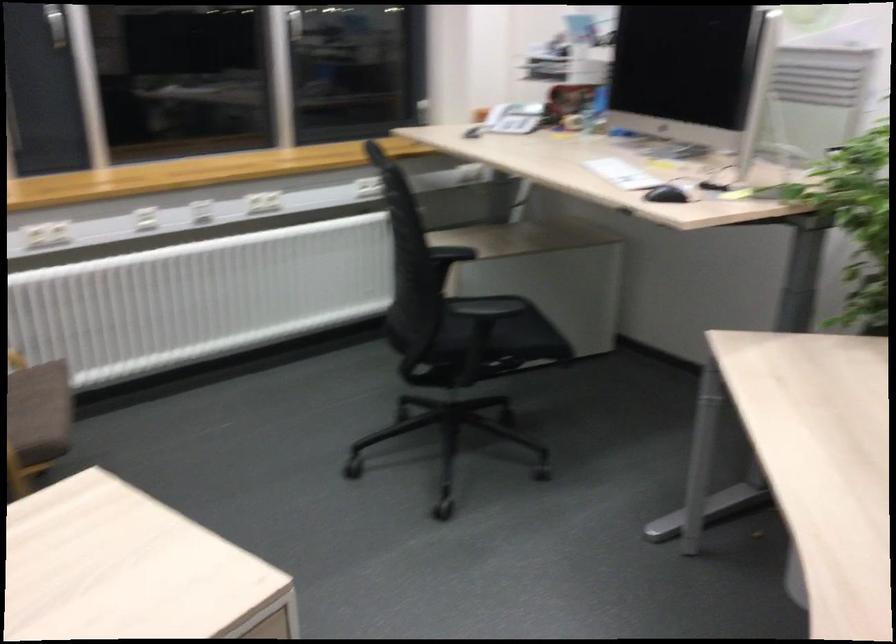
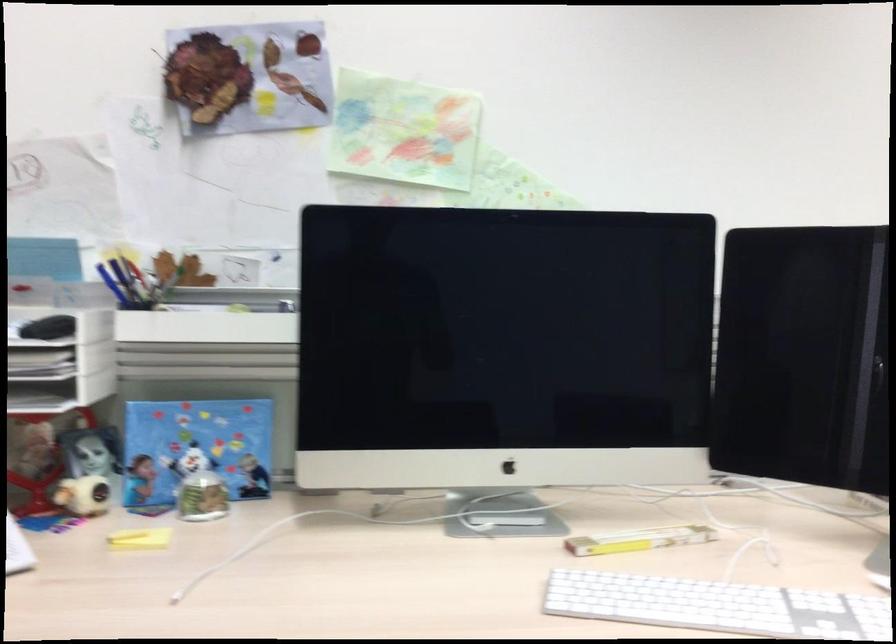
In the second image, find the point that corresponds to the point at 570,131 in the first image.

(140, 538)